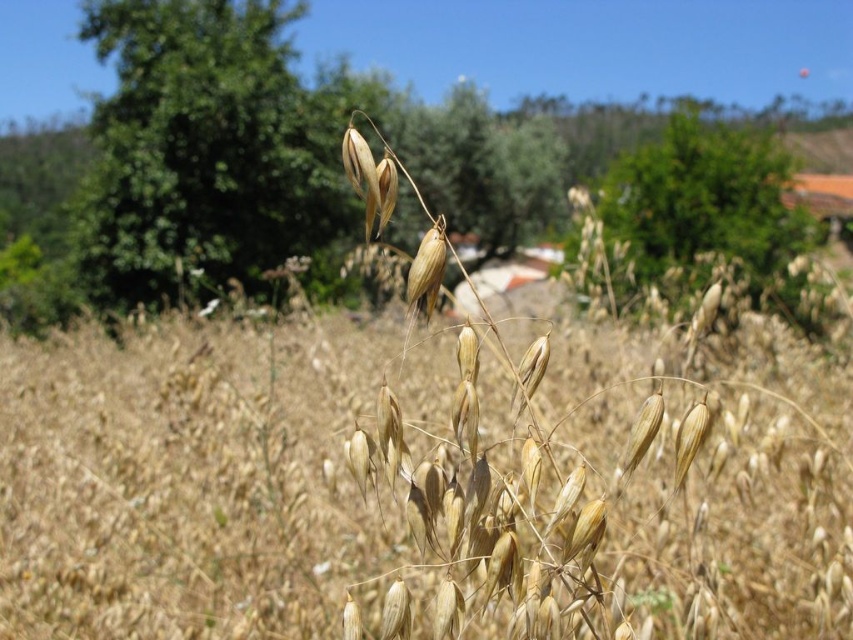
Does dry straw wheat at center appear on the left side of green leafy tree at upper center?

Indeed, dry straw wheat at center is positioned on the left side of green leafy tree at upper center.

You are a GUI agent. You are given a task and a screenshot of the screen. Output one action in this format:
    pyautogui.click(x=<x>, y=<y>)
    Task: Click on the dry straw wheat at center
    The height and width of the screenshot is (640, 853).
    Given the screenshot: What is the action you would take?
    pyautogui.click(x=196, y=490)

This screenshot has height=640, width=853. Identify the location of dry straw wheat at center. (196, 490).